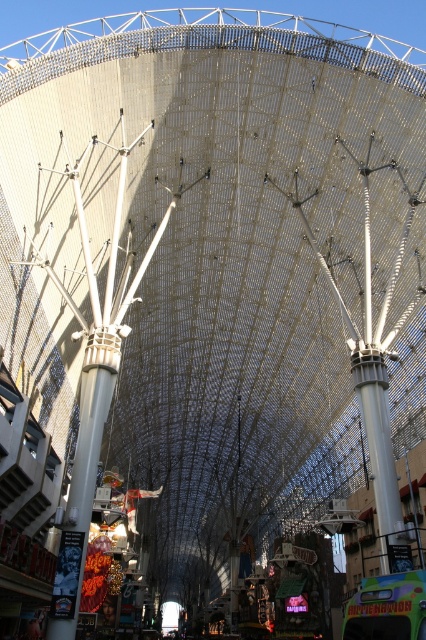
From the picture: Which is below, white metallic pillar at center or white glossy pillar at center?

white metallic pillar at center

Which is more to the right, white metallic pillar at center or white glossy pillar at center?

white glossy pillar at center is more to the right.

Where is `white metallic pillar at center`? white metallic pillar at center is located at coordinates (89, 445).

Identify the location of white metallic pillar at center. (89, 445).